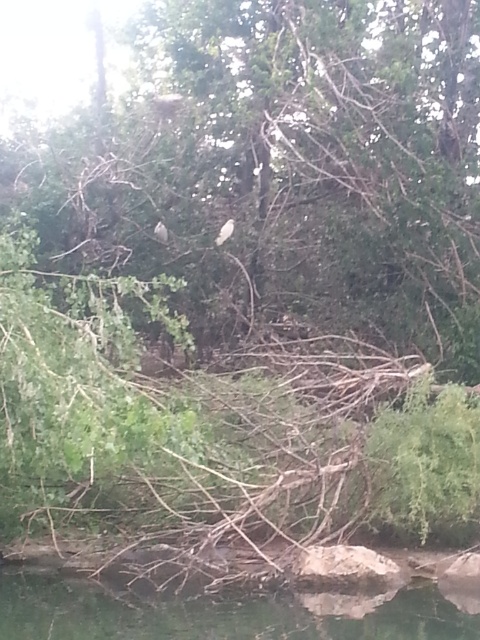
You are a hiker standing at the edge of the river and looking at the green leafy tree at center and the white matte bird at upper center. Which object is higher up in the scene?

The green leafy tree at center is taller than the white matte bird at upper center, so the green leafy tree at center is higher up in the scene.

You are standing in the forest scene looking at the two points marked in the image. Which point, point (435, 275) or point (233, 221), is closer to you?

Point (435, 275) is closer to the camera than point (233, 221).

You are standing at the edge of the water and see the green leafy tree at center and the white matte bird at upper center. Which object is larger in size?

Answer: The green leafy tree at center is bigger than the white matte bird at upper center.